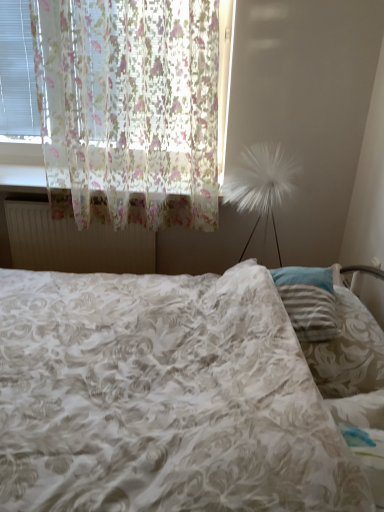
In order to click on floral fabric bed at center in this screenshot , I will do `click(162, 395)`.

In the scene shown: Measure the distance between translucent floral fabric at left and camera.

translucent floral fabric at left and camera are 5.51 feet apart.

Find the location of `floral fabric bed at center`. floral fabric bed at center is located at coordinates (162, 395).

Is white matte radiator at upper left in front of or behind white fluffy lamp at right in the image?

white matte radiator at upper left is positioned farther from the viewer than white fluffy lamp at right.

Is white matte radiator at upper left oriented towards white fluffy lamp at right?

No, white matte radiator at upper left does not turn towards white fluffy lamp at right.

Considering the sizes of objects white matte radiator at upper left and white fluffy lamp at right in the image provided, who is taller, white matte radiator at upper left or white fluffy lamp at right?

white fluffy lamp at right.

Consider the image. From the image's perspective, is white fluffy lamp at right located beneath white matte radiator at upper left?

No.

Is white fluffy lamp at right with white matte radiator at upper left?

white fluffy lamp at right and white matte radiator at upper left are not in contact.

Would you say white matte radiator at upper left is part of white fluffy lamp at right's contents?

No.

Is white fluffy lamp at right looking in the opposite direction of white matte radiator at upper left?

No, white fluffy lamp at right's orientation is not away from white matte radiator at upper left.

Is white fluffy lamp at right inside or outside of translucent floral fabric at left?

white fluffy lamp at right cannot be found inside translucent floral fabric at left.

From a real-world perspective, does white fluffy lamp at right stand above translucent floral fabric at left?

Actually, white fluffy lamp at right is physically below translucent floral fabric at left in the real world.

Which is nearer, [269,162] or [53,136]?

Point [269,162] is positioned closer to the camera compared to point [53,136].

Is white fluffy lamp at right at the right side of translucent floral fabric at left?

Correct, you'll find white fluffy lamp at right to the right of translucent floral fabric at left.

From a real-world perspective, is translucent floral fabric at left located beneath white matte radiator at upper left?

No, from a real-world perspective, translucent floral fabric at left is not beneath white matte radiator at upper left.

Which object is positioned more to the left, translucent floral fabric at left or white matte radiator at upper left?

From the viewer's perspective, white matte radiator at upper left appears more on the left side.

At what (x,y) coordinates should I click in order to perform the action: click on radiator directly beneath the translucent floral fabric at left (from a real-world perspective). Please return your answer as a coordinate pair (x, y). Looking at the image, I should click on (74, 243).

Looking at this image, which object is positioned more to the right, white matte radiator at upper left or translucent floral fabric at left?

From the viewer's perspective, translucent floral fabric at left appears more on the right side.

Do you think white matte radiator at upper left is within translucent floral fabric at left, or outside of it?

→ white matte radiator at upper left lies outside translucent floral fabric at left.

Is white matte radiator at upper left facing away from translucent floral fabric at left?

No, white matte radiator at upper left is not facing away from translucent floral fabric at left.

From the image's perspective, which one is positioned higher, white fluffy lamp at right or floral fabric bed at center?

white fluffy lamp at right appears higher in the image.

Is white fluffy lamp at right oriented away from floral fabric bed at center?

No, white fluffy lamp at right's orientation is not away from floral fabric bed at center.

In the image, is white fluffy lamp at right positioned in front of or behind floral fabric bed at center?

Result: Visually, white fluffy lamp at right is located behind floral fabric bed at center.

Can you confirm if white fluffy lamp at right is positioned to the left of floral fabric bed at center?

In fact, white fluffy lamp at right is to the right of floral fabric bed at center.

Looking at this image, which is correct: white matte radiator at upper left is inside floral fabric bed at center, or outside of it?

white matte radiator at upper left is not enclosed by floral fabric bed at center.

From a real-world perspective, is white matte radiator at upper left physically above floral fabric bed at center?

Yes, from a real-world perspective, white matte radiator at upper left is on top of floral fabric bed at center.

Can you confirm if white matte radiator at upper left is positioned to the left of floral fabric bed at center?

Yes.

Where is `radiator on the left of white fluffy lamp at right`? The image size is (384, 512). radiator on the left of white fluffy lamp at right is located at coordinates (74, 243).

Identify the location of radiator below the white fluffy lamp at right (from the image's perspective). This screenshot has height=512, width=384. (74, 243).

When comparing their distances from white matte radiator at upper left, does white fluffy lamp at right or translucent floral fabric at left seem closer?

Among the two, translucent floral fabric at left is located nearer to white matte radiator at upper left.

From the image, which object appears to be nearer to white fluffy lamp at right, floral fabric bed at center or translucent floral fabric at left?

Based on the image, translucent floral fabric at left appears to be nearer to white fluffy lamp at right.

Based on their spatial positions, is translucent floral fabric at left or white fluffy lamp at right further from white matte radiator at upper left?

The object further to white matte radiator at upper left is white fluffy lamp at right.

When comparing their distances from translucent floral fabric at left, does white fluffy lamp at right or floral fabric bed at center seem closer?

white fluffy lamp at right lies closer to translucent floral fabric at left than the other object.

Which object lies nearer to the anchor point translucent floral fabric at left, white matte radiator at upper left or floral fabric bed at center?

Based on the image, white matte radiator at upper left appears to be nearer to translucent floral fabric at left.

Considering their positions, is translucent floral fabric at left positioned closer to white fluffy lamp at right than floral fabric bed at center?

Based on the image, translucent floral fabric at left appears to be nearer to white fluffy lamp at right.

Estimate the real-world distances between objects in this image. Which object is closer to translucent floral fabric at left, white matte radiator at upper left or white fluffy lamp at right?

Among the two, white matte radiator at upper left is located nearer to translucent floral fabric at left.

From the picture: Looking at the image, which one is located closer to floral fabric bed at center, white fluffy lamp at right or translucent floral fabric at left?

Among the two, translucent floral fabric at left is located nearer to floral fabric bed at center.

Find the location of a particular element. This screenshot has width=384, height=512. table lamp between floral fabric bed at center and white matte radiator at upper left in the front-back direction is located at coordinates (260, 184).

Where is `curtain positioned between floral fabric bed at center and white matte radiator at upper left from near to far`? curtain positioned between floral fabric bed at center and white matte radiator at upper left from near to far is located at coordinates (129, 109).

I want to click on curtain between floral fabric bed at center and white fluffy lamp at right along the z-axis, so click(129, 109).

Locate an element on the screen. curtain between white matte radiator at upper left and white fluffy lamp at right from left to right is located at coordinates (129, 109).